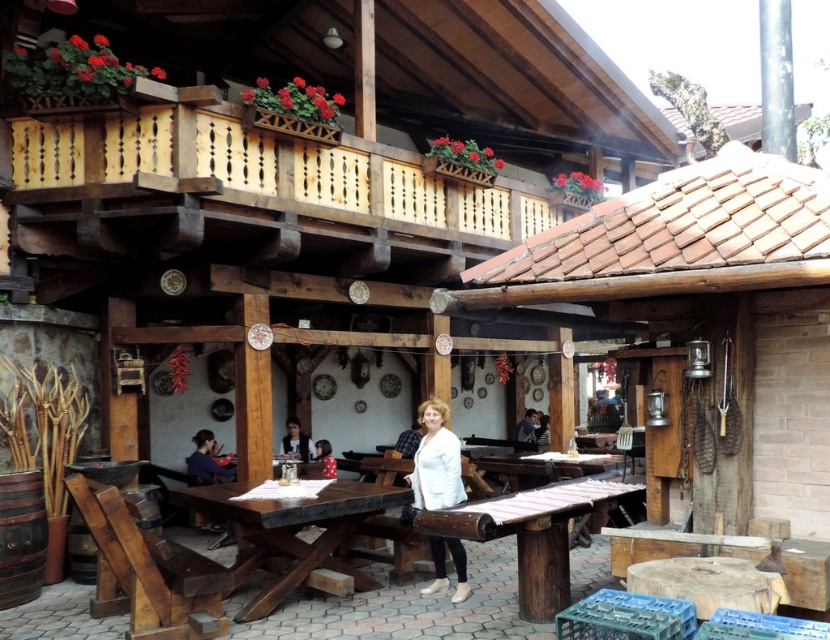
Can you confirm if white matte jacket at center is smaller than smooth brown hair at center?

No.

Does white matte jacket at center have a lesser width compared to smooth brown hair at center?

No, white matte jacket at center is not thinner than smooth brown hair at center.

Locate an element on the screen. white matte jacket at center is located at coordinates (437, 461).

Locate an element on the screen. Image resolution: width=830 pixels, height=640 pixels. white matte jacket at center is located at coordinates (437, 461).

Is point (448, 541) farther from camera compared to point (530, 420)?

No, (448, 541) is closer to viewer.

Find the location of a particular element. The width and height of the screenshot is (830, 640). white matte jacket at center is located at coordinates (437, 461).

Identify the location of white matte jacket at center. (437, 461).

Who is taller, rustic wooden table at center or wooden table at center?

wooden table at center is taller.

Who is shorter, rustic wooden table at center or wooden table at center?

rustic wooden table at center is shorter.

Is point (293, 536) behind point (562, 538)?

Yes.

Where is `rustic wooden table at center`? The height and width of the screenshot is (640, 830). rustic wooden table at center is located at coordinates (290, 532).